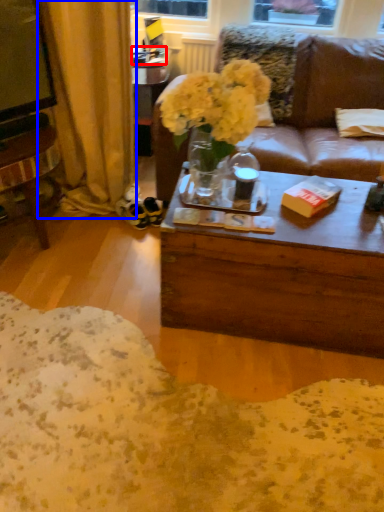
Question: Which of the following is the closest to the observer, box (highlighted by a red box) or curtain (highlighted by a blue box)?

Choices:
 (A) box
 (B) curtain

Answer: (B)